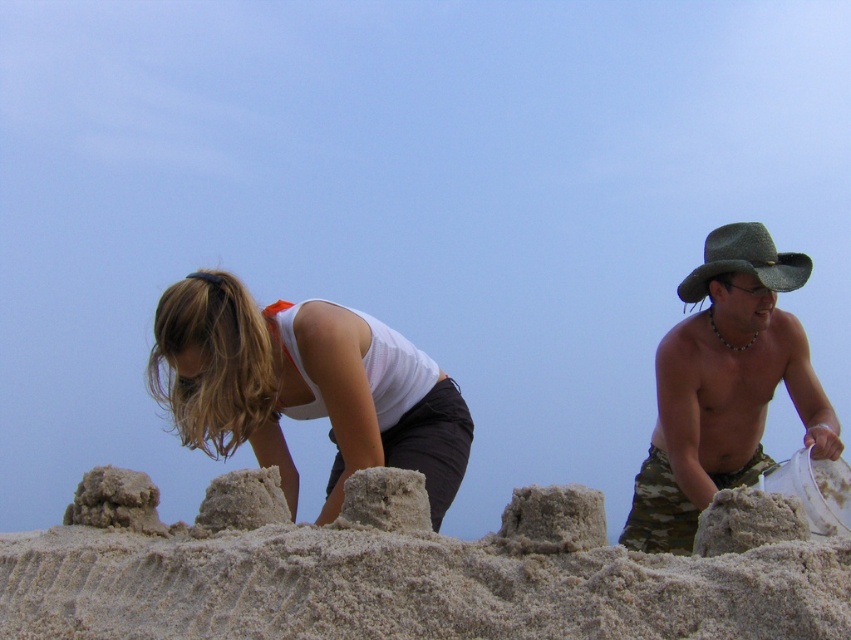
Question: Which of the following is the closest to the observer?

Choices:
 (A) green felt cowboy hat at right
 (B) camouflage shorts at right

Answer: (B)

Question: Estimate the real-world distances between objects in this image. Which object is closer to the camouflage shorts at right?

Choices:
 (A) green felt cowboy hat at right
 (B) white matte tank top at center

Answer: (A)

Question: Can you confirm if white matte tank top at center is positioned below green felt cowboy hat at right?

Choices:
 (A) no
 (B) yes

Answer: (B)

Question: Among these points, which one is nearest to the camera?

Choices:
 (A) (686, 368)
 (B) (341, 436)

Answer: (B)

Question: Does white matte tank top at center have a larger size compared to green felt cowboy hat at right?

Choices:
 (A) no
 (B) yes

Answer: (B)

Question: Is white matte tank top at center below green felt cowboy hat at right?

Choices:
 (A) no
 (B) yes

Answer: (B)